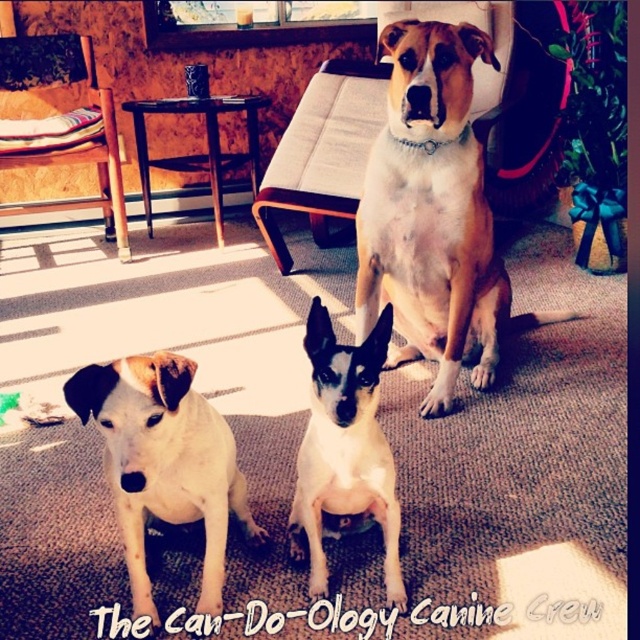
Is point (433, 44) farther from camera compared to point (104, 180)?

That is False.

Is light brown fur at center above brushed wood chair at left?

No, light brown fur at center is not above brushed wood chair at left.

Is point (397, 177) closer to camera compared to point (120, 241)?

Yes.

Locate an element on the screen. The height and width of the screenshot is (640, 640). light brown fur at center is located at coordinates (432, 212).

Does white smooth dog at center have a lesser width compared to brushed wood chair at left?

Indeed, white smooth dog at center has a lesser width compared to brushed wood chair at left.

Which of these two, white smooth dog at center or brushed wood chair at left, stands taller?

brushed wood chair at left

Who is more distant from viewer, (x=321, y=593) or (x=64, y=84)?

The point (x=64, y=84) is behind.

Locate an element on the screen. white smooth dog at center is located at coordinates (344, 449).

Which is in front, point (120, 376) or point (74, 129)?

Point (120, 376) is in front.

Identify the location of white fur dog at lower left. This screenshot has width=640, height=640. (164, 461).